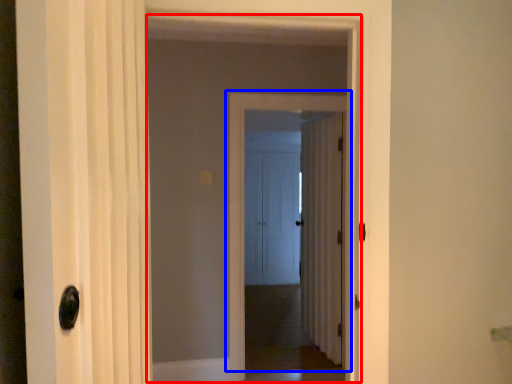
Question: Which of the following is the closest to the observer, elevator (highlighted by a red box) or door (highlighted by a blue box)?

Choices:
 (A) elevator
 (B) door

Answer: (A)